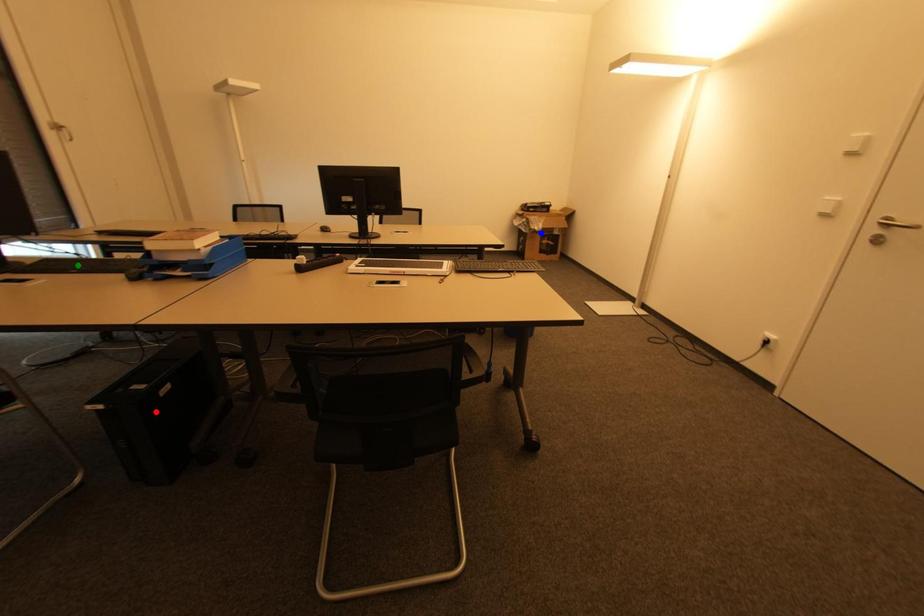
Order these from nearest to farthest:
A) blue point
B) green point
C) red point

red point, green point, blue point